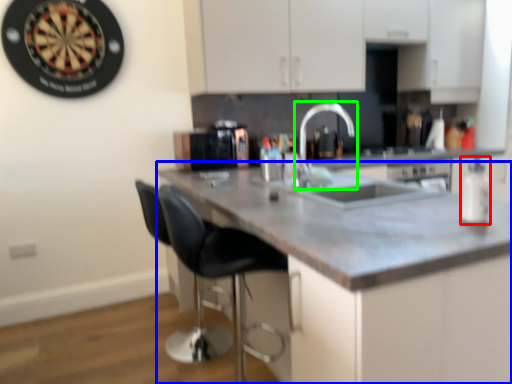
Question: Considering the real-world distances, which object is farthest from bottle (highlighted by a red box)? countertop (highlighted by a blue box) or tap (highlighted by a green box)?

Choices:
 (A) countertop
 (B) tap

Answer: (B)